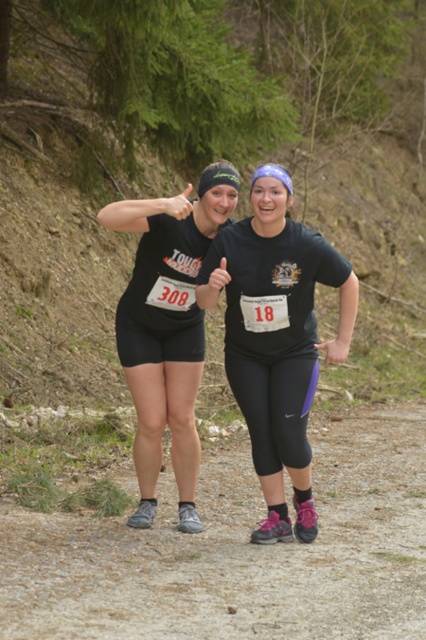
Looking at this image, what is the exact coordinate of the dirt track at center?

The dirt track at center is located at point (238, 552).

You are a runner in the race and you see the point at coordinates (238, 552). What is located at that point?

The point at coordinates (238, 552) corresponds to the dirt track at center.